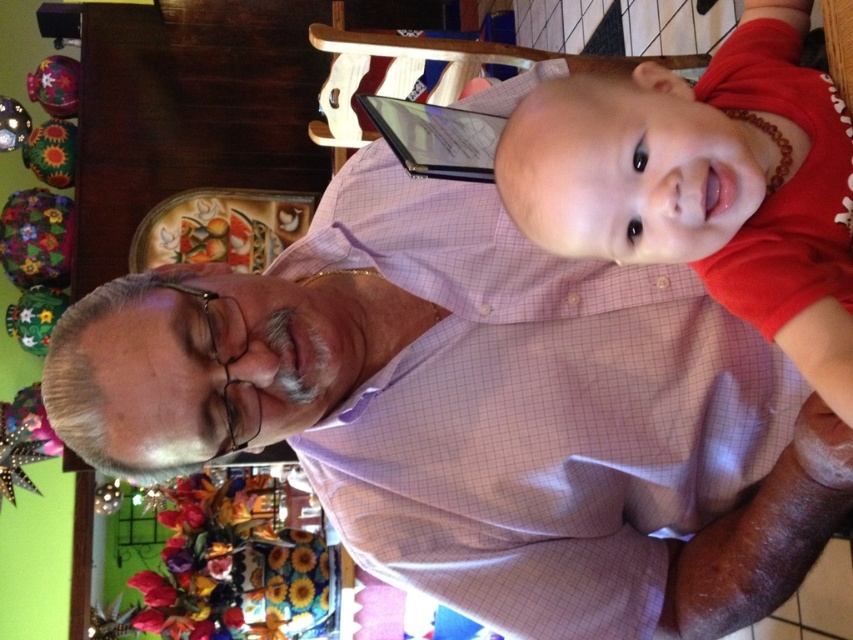
Looking at this image, you are an interior designer assessing the placement of objects in the scene. The red matte shirt at upper right and the matte black tablet at upper center are both on the wooden table. Which object occupies more horizontal space on the table?

The red matte shirt at upper right occupies more horizontal space on the table than the matte black tablet at upper center because its width surpasses the tablet.

You are a photographer setting up for a family photo. You notice the red matte shirt at upper right and the matte black tablet at upper center in the background. Which object should you adjust to ensure the tablet is fully visible in the photo?

The red matte shirt at upper right is in front of the matte black tablet at upper center, so you should adjust the red matte shirt at upper right to ensure the tablet is fully visible in the photo.

You are an interior designer working on a project. You need to place a new lamp at the point marked by the coordinates point (705, 186). According to the image, what object is currently located at that position?

The point (705, 186) marks the location of the red matte shirt at upper right.